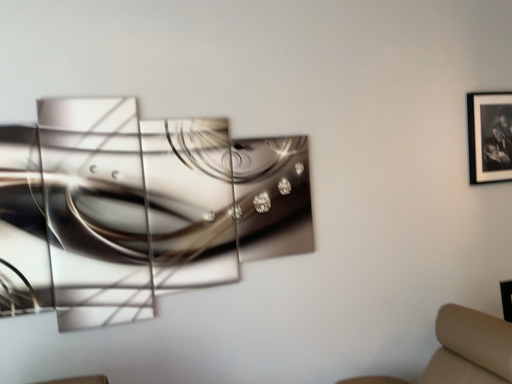
What do you see at coordinates (490, 136) in the screenshot? This screenshot has height=384, width=512. I see `black matte picture frame at upper right` at bounding box center [490, 136].

Locate an element on the screen. black matte picture frame at upper right is located at coordinates (490, 136).

The width and height of the screenshot is (512, 384). I want to click on black matte picture frame at upper right, so click(x=490, y=136).